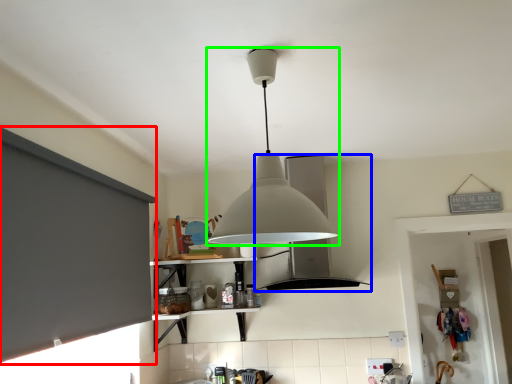
Question: Considering the real-world distances, which object is farthest from window screen (highlighted by a red box)? vent (highlighted by a blue box) or lamp (highlighted by a green box)?

Choices:
 (A) vent
 (B) lamp

Answer: (A)